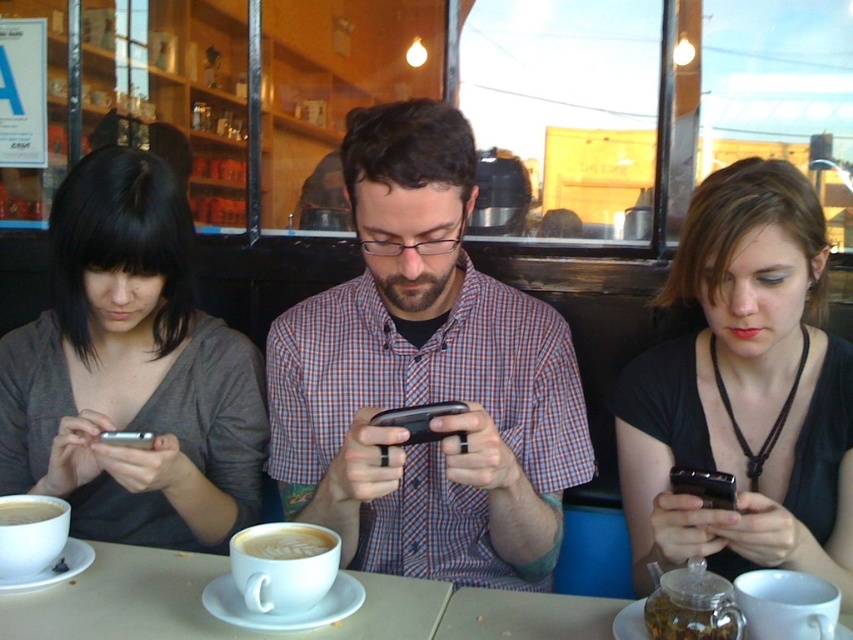
Is point (662, 451) positioned after point (36, 618)?

Yes, point (662, 451) is behind point (36, 618).

Between point (802, 266) and point (440, 608), which one is positioned behind?

Positioned behind is point (802, 266).

Find the location of a particular element. black matte phone at center is located at coordinates (743, 392).

Between point (463, 269) and point (431, 593), which one is positioned in front?

Positioned in front is point (431, 593).

The image size is (853, 640). Identify the location of plaid shirt at center. (425, 378).

Who is more forward, (521,492) or (132,570)?

Point (132,570) is more forward.

Identify the location of plaid shirt at center. (425, 378).

Is white frothy coffee at center to the right of smooth matte cup at lower left from the viewer's perspective?

Indeed, white frothy coffee at center is positioned on the right side of smooth matte cup at lower left.

Between point (322, 538) and point (15, 509), which one is positioned behind?

The point (15, 509) is more distant.

Between point (279, 532) and point (0, 502), which one is positioned in front?

Point (279, 532) is more forward.

The height and width of the screenshot is (640, 853). I want to click on white frothy coffee at center, so click(x=286, y=541).